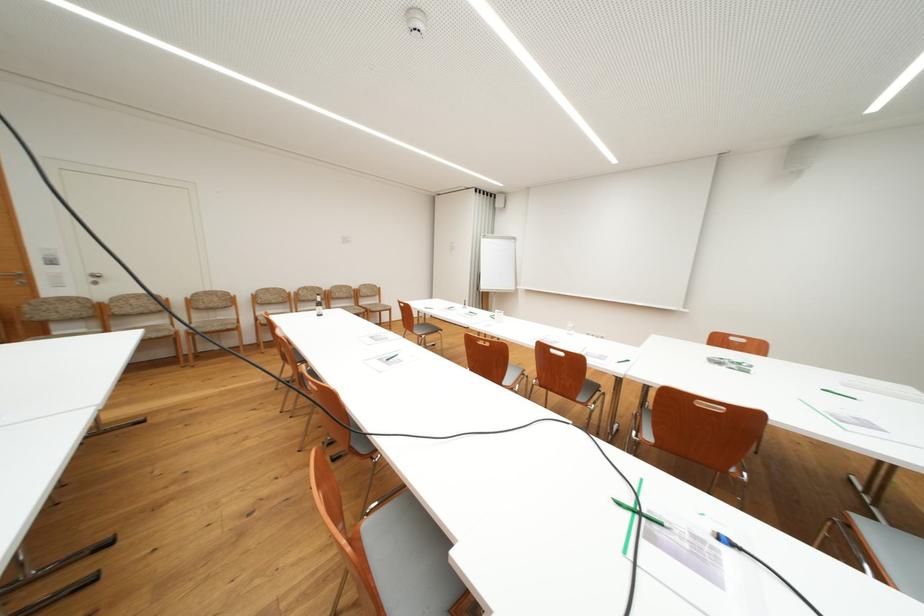
Describe the element at coordinates (14, 277) in the screenshot. I see `a metal door handle` at that location.